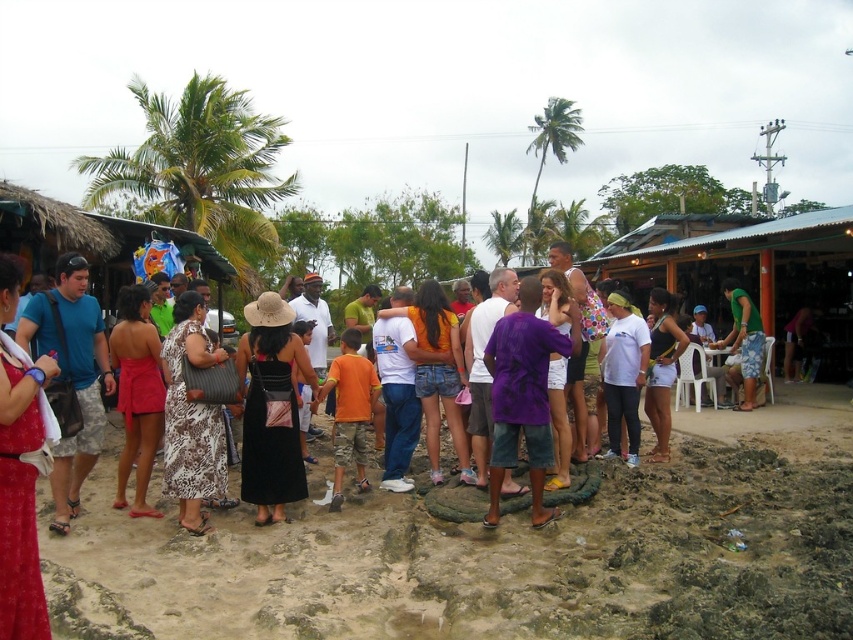
You are at the beach and want to walk from the brown sandy mud at center to the green fabric shirt at right. Which direction should you move?

You should move to the right because the brown sandy mud at center is to the left of the green fabric shirt at right.

You are at a beach gathering and want to take a photo of the black dress at center and the green leafy palm tree at upper center. Which object is located to the left of the other?

The black dress at center is positioned on the left side of green leafy palm tree at upper center.

You are a photographer at the beach gathering. You want to take a photo that includes both the black dress at center and the green leafy palm tree at upper center. Which object will appear taller in the photo?

The green leafy palm tree at upper center will appear taller in the photo because the black dress at center is not as tall as it.